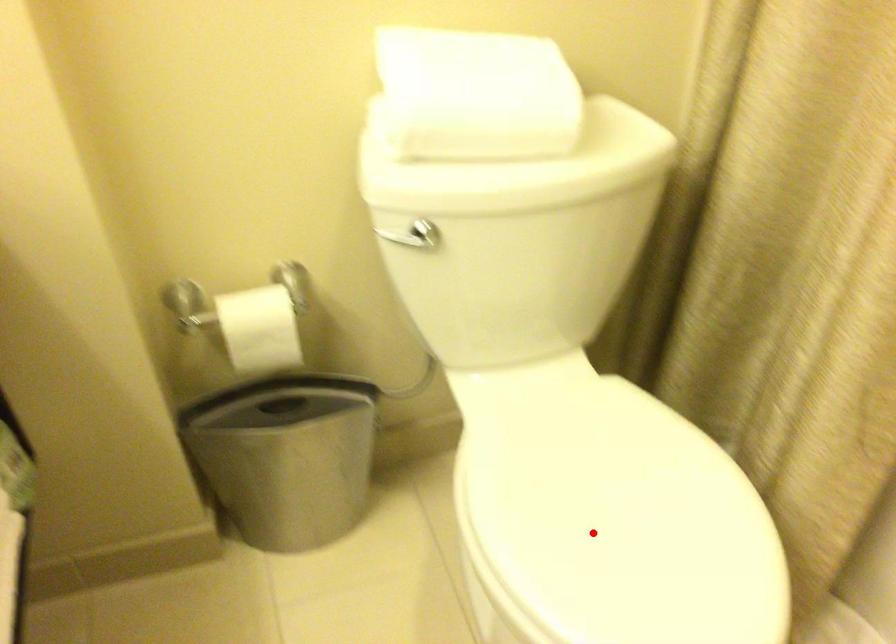
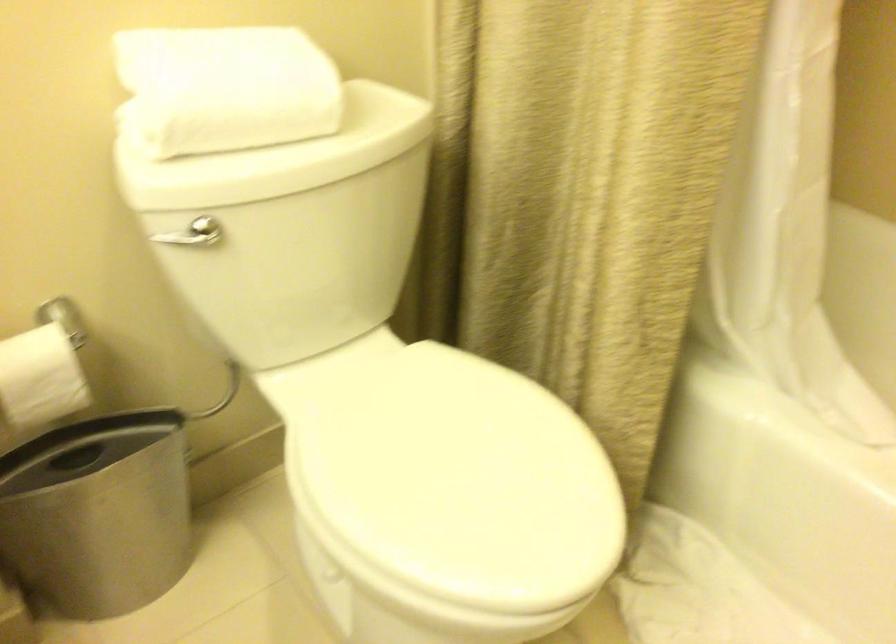
In the second image, find the point that corresponds to the highlighted location in the first image.

(442, 485)